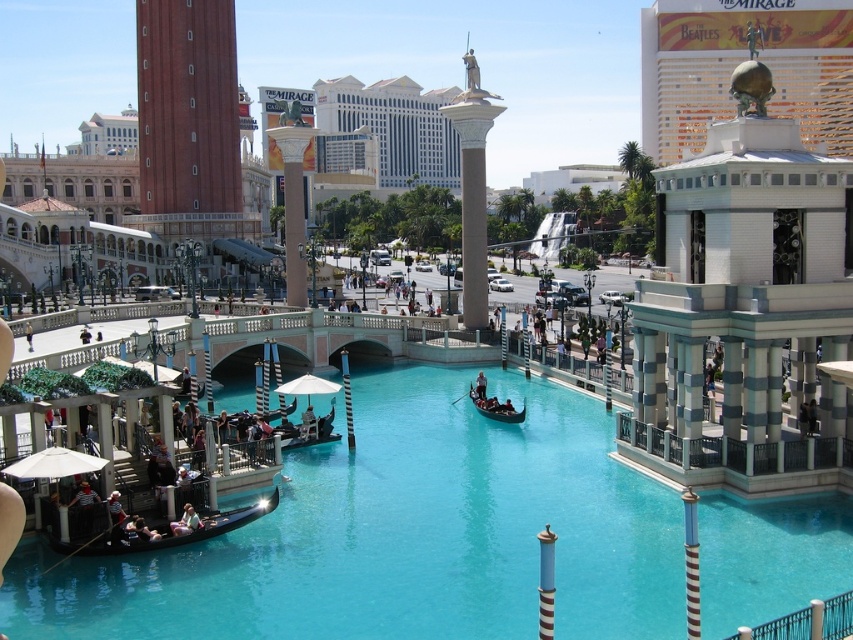
Between wooden gondola at center and light blue fabric person at lower left, which one is positioned lower?

light blue fabric person at lower left

Can you confirm if wooden gondola at center is thinner than light blue fabric person at lower left?

Incorrect, wooden gondola at center's width is not less than light blue fabric person at lower left's.

Locate an element on the screen. This screenshot has width=853, height=640. wooden gondola at center is located at coordinates (495, 406).

Can you confirm if teal glossy water at center is positioned below smooth black boat at center?

Yes.

Does teal glossy water at center have a smaller size compared to smooth black boat at center?

No.

What do you see at coordinates (402, 536) in the screenshot? The height and width of the screenshot is (640, 853). I see `teal glossy water at center` at bounding box center [402, 536].

Where is `teal glossy water at center`? The height and width of the screenshot is (640, 853). teal glossy water at center is located at coordinates click(x=402, y=536).

Which of these two, terracotta brick tower at left or smooth black boat at center, stands taller?

terracotta brick tower at left

Is terracotta brick tower at left to the right of smooth black boat at center from the viewer's perspective?

In fact, terracotta brick tower at left is to the left of smooth black boat at center.

Which is behind, point (169, 52) or point (479, 376)?

Point (169, 52)

At what (x,y) coordinates should I click in order to perform the action: click on terracotta brick tower at left. Please return your answer as a coordinate pair (x, y). Looking at the image, I should click on (189, 122).